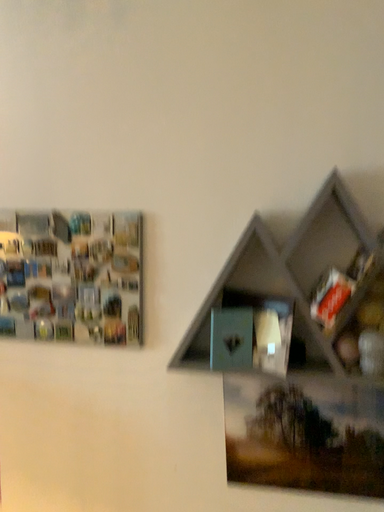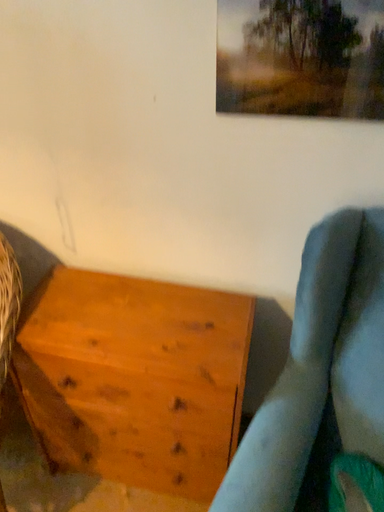
Question: Which way did the camera rotate in the video?

Choices:
 (A) rotated upward
 (B) rotated downward

Answer: (B)